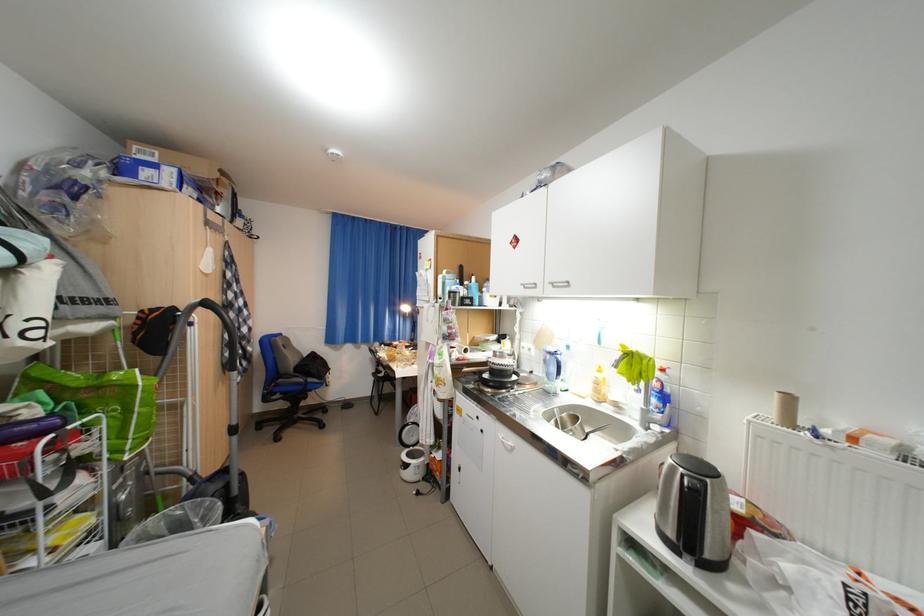
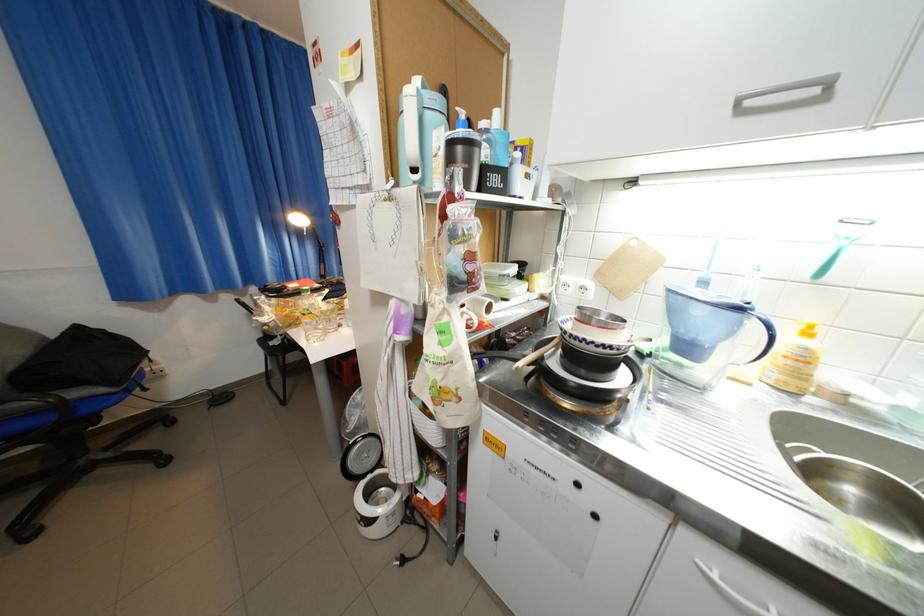
Question: The images are taken continuously from a first-person perspective. In which direction are you moving?

Choices:
 (A) Left
 (B) Right
 (C) Forward
 (D) Backward

Answer: (C)